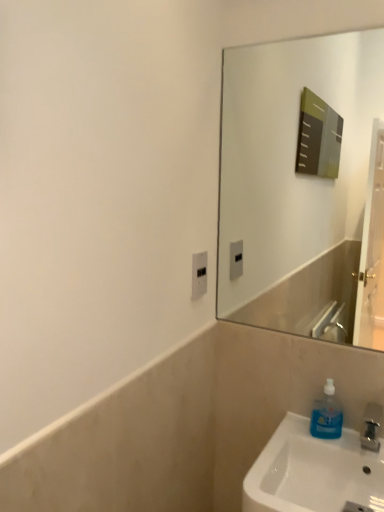
Question: Does white plastic electric outlet at center have a greater height compared to blue translucent soap dispenser at lower right?

Choices:
 (A) no
 (B) yes

Answer: (A)

Question: Is blue translucent soap dispenser at lower right surrounded by white plastic electric outlet at center?

Choices:
 (A) no
 (B) yes

Answer: (A)

Question: Can you confirm if white plastic electric outlet at center is bigger than blue translucent soap dispenser at lower right?

Choices:
 (A) yes
 (B) no

Answer: (B)

Question: Can you confirm if white plastic electric outlet at center is positioned to the right of blue translucent soap dispenser at lower right?

Choices:
 (A) yes
 (B) no

Answer: (B)

Question: Can you see white plastic electric outlet at center touching blue translucent soap dispenser at lower right?

Choices:
 (A) no
 (B) yes

Answer: (A)

Question: Is white plastic electric outlet at center smaller than blue translucent soap dispenser at lower right?

Choices:
 (A) no
 (B) yes

Answer: (B)

Question: From a real-world perspective, does blue translucent soap dispenser at lower right sit lower than white plastic electric outlet at center?

Choices:
 (A) no
 (B) yes

Answer: (B)

Question: Considering the relative sizes of blue translucent soap dispenser at lower right and white plastic electric outlet at center in the image provided, is blue translucent soap dispenser at lower right bigger than white plastic electric outlet at center?

Choices:
 (A) no
 (B) yes

Answer: (B)

Question: From the image's perspective, is blue translucent soap dispenser at lower right on top of white plastic electric outlet at center?

Choices:
 (A) yes
 (B) no

Answer: (B)

Question: From a real-world perspective, is blue translucent soap dispenser at lower right located higher than white plastic electric outlet at center?

Choices:
 (A) yes
 (B) no

Answer: (B)

Question: Is blue translucent soap dispenser at lower right to the right of white plastic electric outlet at center from the viewer's perspective?

Choices:
 (A) no
 (B) yes

Answer: (B)

Question: Does blue translucent soap dispenser at lower right have a greater width compared to white plastic electric outlet at center?

Choices:
 (A) no
 (B) yes

Answer: (B)

Question: Looking at the image, does white plastic electric outlet at center seem bigger or smaller compared to blue translucent soap dispenser at lower right?

Choices:
 (A) big
 (B) small

Answer: (B)